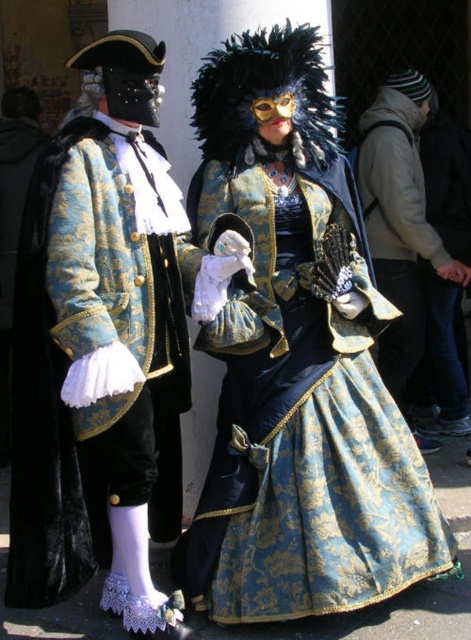
You are standing in front of the image and want to touch the gold brocade dress at center. If you move your hand straight forward from your current position, will it reach the point at coordinates point [302,424]?

The point [302,424] is on the gold brocade dress at center, so moving your hand straight forward will reach that point.

You are a photographer at a costume event and need to arrange the gold brocade dress at center and the matte black coat at center for a photo. Which costume should be placed to the right side to match the original image?

The gold brocade dress at center should be placed to the left side of the matte black coat at center, so to match the original image, the matte black coat at center should be positioned to the right of the gold brocade dress at center.

You are a costume designer preparing for a play. You have two costumes in the scene described. The gold brocade dress at center and the matte black coat at center. Which costume requires more fabric to construct?

The gold brocade dress at center requires more fabric to construct because it is larger in size than the matte black coat at center.